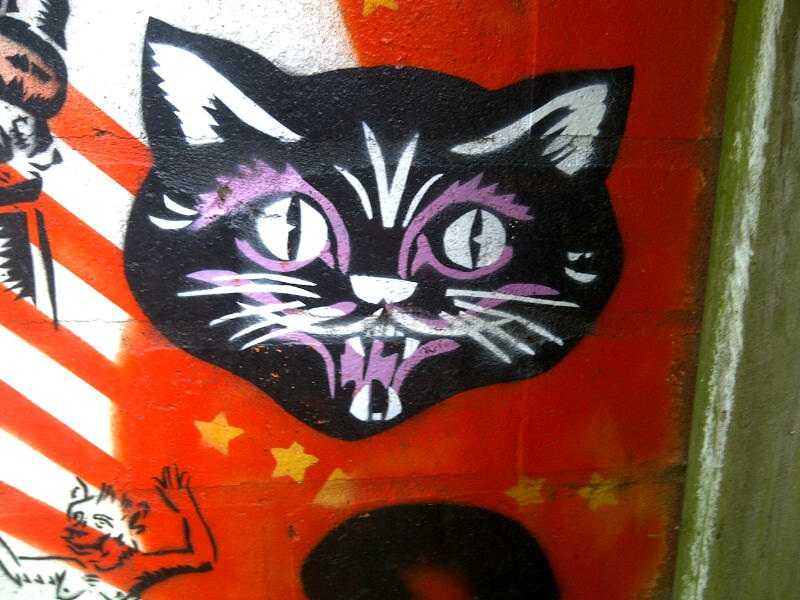
I want to click on the chest, so click(66, 590).